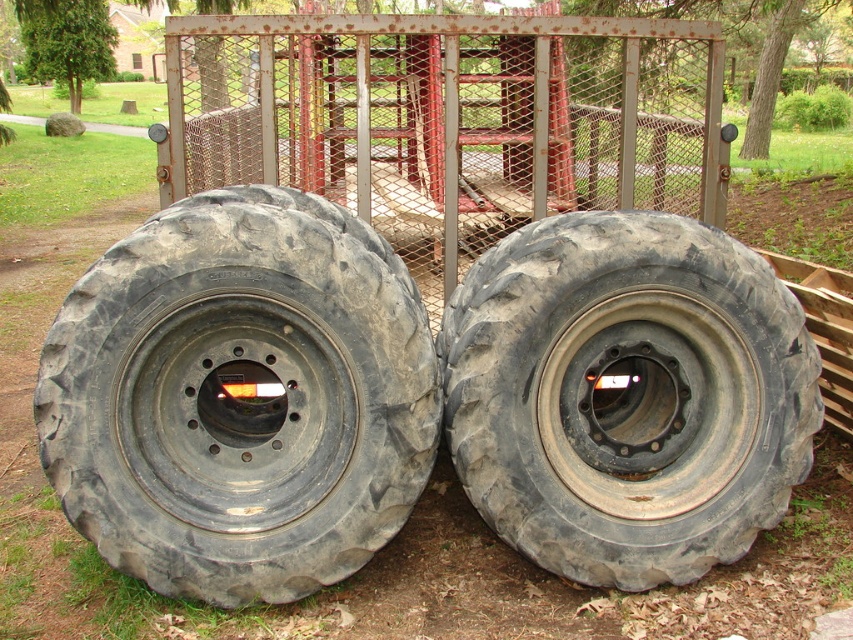
Does black rubber tire at left have a lesser height compared to black rubber tire at center?

No, black rubber tire at left is not shorter than black rubber tire at center.

Is black rubber tire at left in front of black rubber tire at center?

Yes, it is in front of black rubber tire at center.

Is point (241, 547) in front of point (651, 224)?

Yes, point (241, 547) is closer to viewer.

Identify the location of black rubber tire at left. [241, 397].